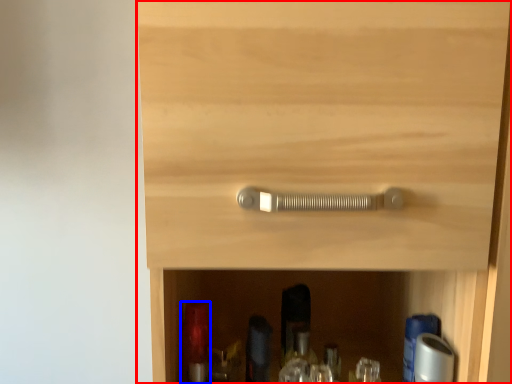
Question: Among these objects, which one is nearest to the camera, cupboard (highlighted by a red box) or bottle (highlighted by a blue box)?

Choices:
 (A) cupboard
 (B) bottle

Answer: (A)